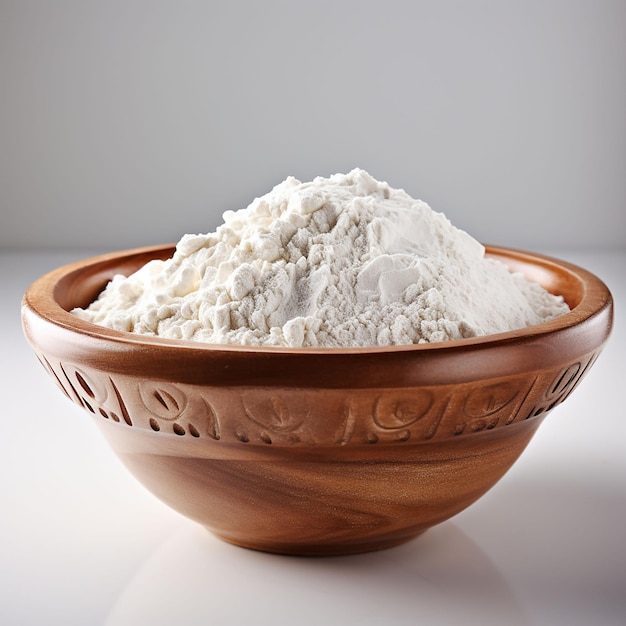
Where is `surface`? surface is located at coordinates (64, 456).